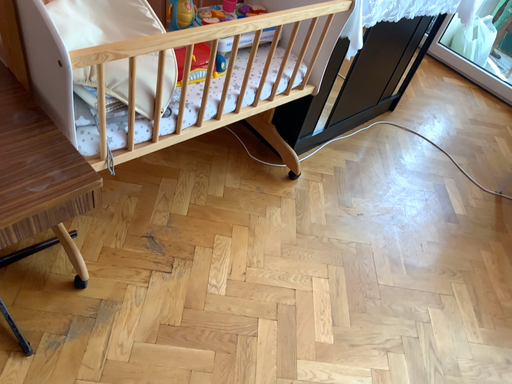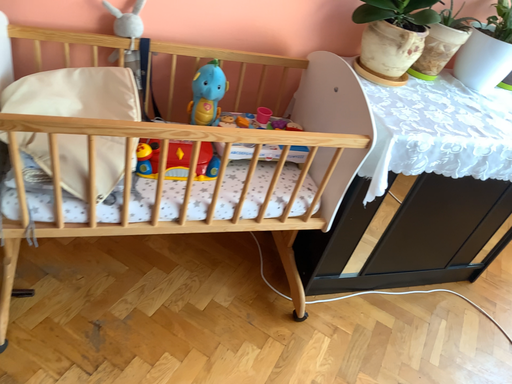
Question: Which way did the camera rotate in the video?

Choices:
 (A) rotated downward
 (B) rotated upward

Answer: (B)